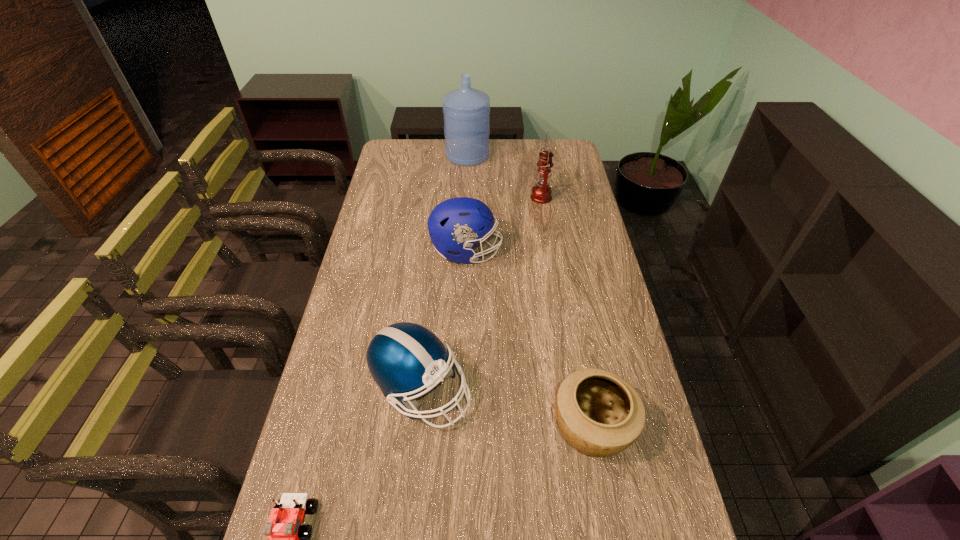
Locate an element on the screen. Image resolution: width=960 pixels, height=540 pixels. the farthest object is located at coordinates (466, 111).

The image size is (960, 540). Find the location of `the tallest object`. the tallest object is located at coordinates (466, 111).

I want to click on the second farthest object, so click(541, 193).

Locate an element on the screen. oil lamp is located at coordinates pyautogui.click(x=541, y=193).

In order to click on the fourth nearest object in this screenshot , I will do `click(457, 224)`.

Identify the location of the nearer football helmet. (404, 358).

Locate an element on the screen. This screenshot has height=540, width=960. the fifth tallest object is located at coordinates (600, 414).

Identify the location of free space located on the side of the water jug with the handle. (468, 139).

Where is `vacant space located on the left of the fifth nearest object`? This screenshot has width=960, height=540. vacant space located on the left of the fifth nearest object is located at coordinates (437, 197).

The width and height of the screenshot is (960, 540). Identify the location of free space located 0.330m on the face guard of the farther football helmet. (592, 252).